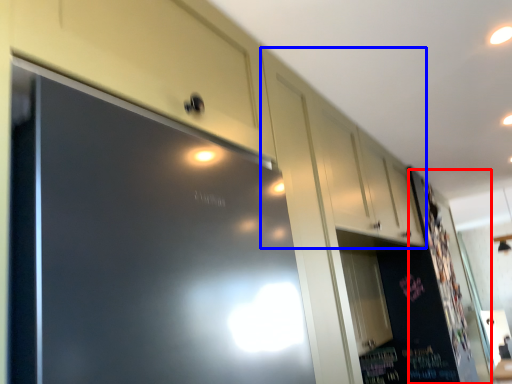
Question: Which object is closer to the camera taking this photo, bulletin board (highlighted by a red box) or cabinetry (highlighted by a blue box)?

Choices:
 (A) bulletin board
 (B) cabinetry

Answer: (B)